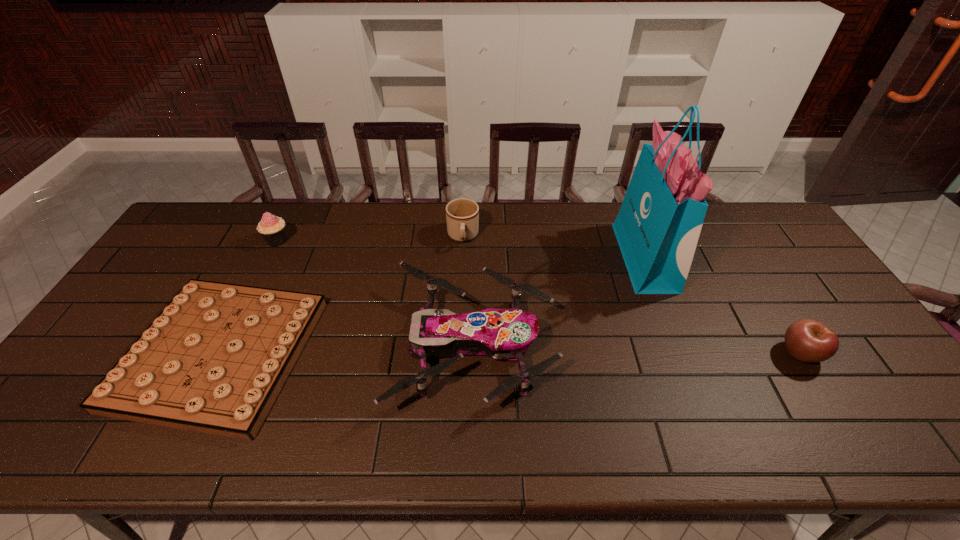
This screenshot has height=540, width=960. Identify the location of free space located 0.390m on the front-facing side of the drone. (704, 346).

This screenshot has height=540, width=960. In order to click on free space located on the side of the rightmost object with the unique marking in this screenshot , I will do `click(858, 446)`.

Image resolution: width=960 pixels, height=540 pixels. What are the coordinates of `vacant area located on the back of the shortest object` in the screenshot? It's located at (286, 223).

Find the location of a particular element. The height and width of the screenshot is (540, 960). shopping bag situated at the far edge is located at coordinates (658, 226).

This screenshot has width=960, height=540. Identify the location of cupcake situated at the far edge. pyautogui.click(x=272, y=229).

Locate an element on the screen. Image resolution: width=960 pixels, height=540 pixels. mug located in the far edge section of the desktop is located at coordinates (462, 215).

You are a GUI agent. You are given a task and a screenshot of the screen. Output one action in this format:
    pyautogui.click(x=<x>, y=<y>)
    Task: Click on the drone that is at the near edge
    
    Given the screenshot: What is the action you would take?
    pyautogui.click(x=503, y=334)

Find the location of `gameboard present at the near edge`. gameboard present at the near edge is located at coordinates [214, 360].

This screenshot has height=540, width=960. I want to click on object present at the left edge, so click(x=214, y=360).

Where is `object positioned at the right edge`? The width and height of the screenshot is (960, 540). object positioned at the right edge is located at coordinates (807, 340).